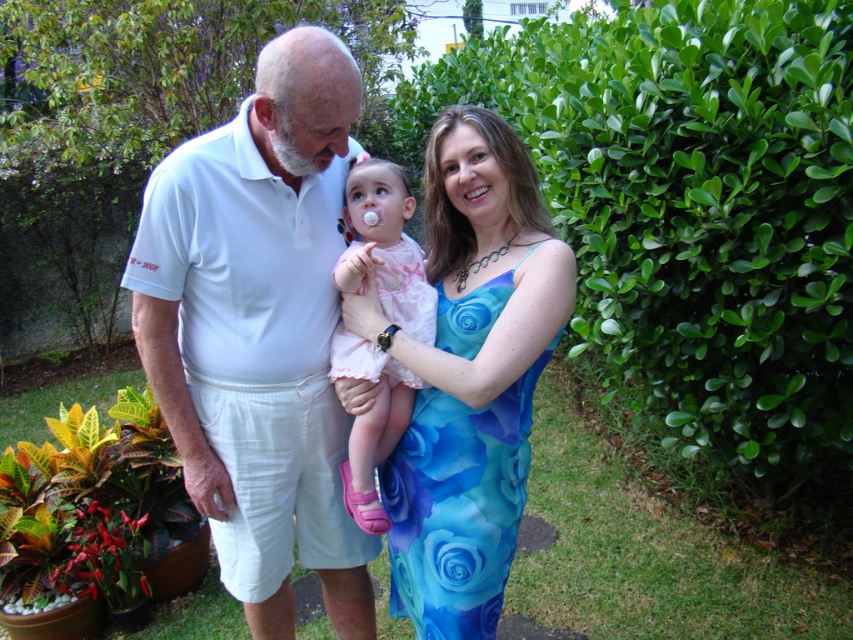
Question: From the image, what is the correct spatial relationship of white cotton shirt at center in relation to blue floral fabric dress at center?

Choices:
 (A) right
 (B) left

Answer: (B)

Question: Can you confirm if green leafy hedge at center right is wider than white cotton shirt at center?

Choices:
 (A) no
 (B) yes

Answer: (B)

Question: Which object is the farthest from the blue floral fabric dress at center?

Choices:
 (A) white cotton shirt at center
 (B) pink satin dress at center

Answer: (A)

Question: Considering the relative positions of green leafy hedge at center right and white cotton shirt at center in the image provided, where is green leafy hedge at center right located with respect to white cotton shirt at center?

Choices:
 (A) right
 (B) left

Answer: (A)

Question: Which is nearer to the pink satin dress at center?

Choices:
 (A) green leafy hedge at center right
 (B) blue floral fabric dress at center

Answer: (B)

Question: Which of these objects is positioned closest to the blue floral fabric dress at center?

Choices:
 (A) pink satin dress at center
 (B) white cotton shirt at center
 (C) green leafy hedge at center right

Answer: (A)